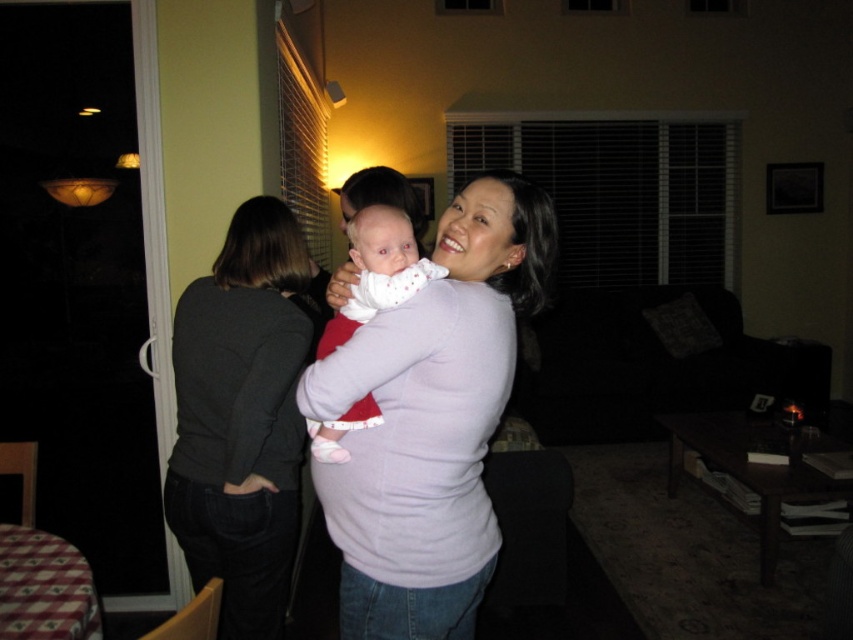
You are a fashion designer observing the scene. You need to decide which clothing item has a larger width between the matte pink shirt at center and the dark gray sweater at left. Which one do you choose?

The matte pink shirt at center has a larger width than the dark gray sweater at left according to the description.

You are standing in the room and notice two points marked in the image. Which point is closer to you, point [251,472] or point [396,268]?

Point [251,472] is closer to you because it is further to the viewer than point [396,268].